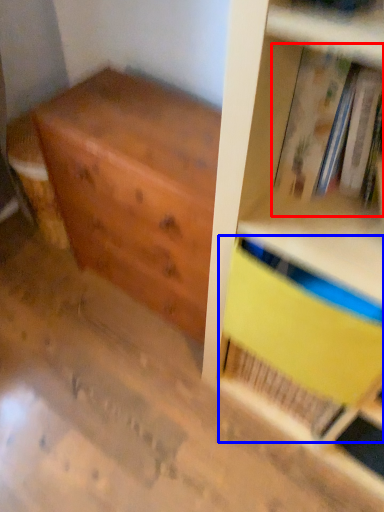
Question: Which of the following is the closest to the observer, book (highlighted by a red box) or paperback book (highlighted by a blue box)?

Choices:
 (A) book
 (B) paperback book

Answer: (A)